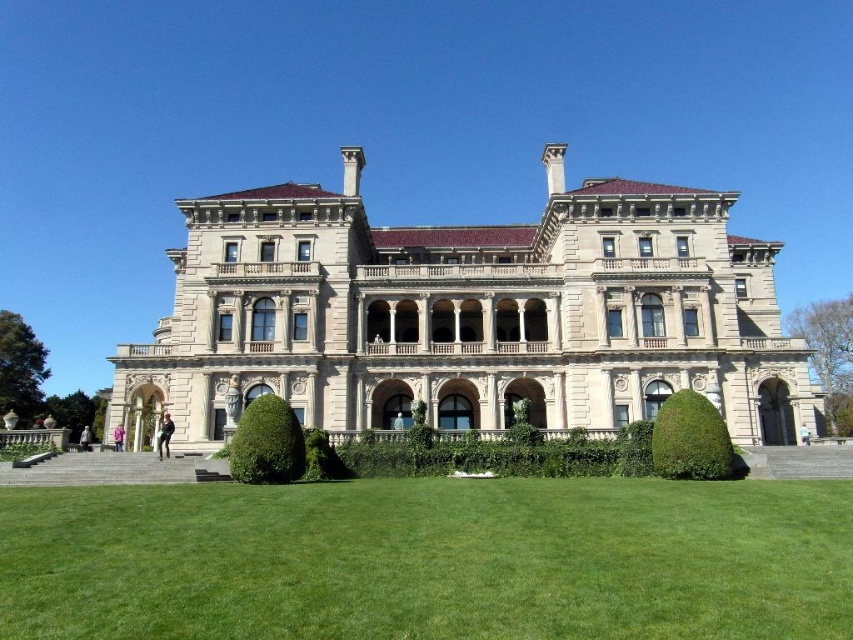
Question: Which object appears farthest from the camera in this image?

Choices:
 (A) green leafy hedge at lower right
 (B) green leafy hedge at center
 (C) green grass at lower center
 (D) beige stone mansion at center

Answer: (D)

Question: Is beige stone mansion at center closer to camera compared to green grass at lower center?

Choices:
 (A) no
 (B) yes

Answer: (A)

Question: In this image, where is beige stone mansion at center located relative to green leafy hedge at lower right?

Choices:
 (A) above
 (B) below

Answer: (A)

Question: Among these points, which one is nearest to the camera?

Choices:
 (A) (262, 426)
 (B) (347, 518)
 (C) (337, 428)
 (D) (683, 465)

Answer: (B)

Question: Estimate the real-world distances between objects in this image. Which object is closer to the green grass at lower center?

Choices:
 (A) green leafy hedge at center
 (B) beige stone mansion at center

Answer: (A)

Question: Is beige stone mansion at center to the left of green leafy hedge at center from the viewer's perspective?

Choices:
 (A) no
 (B) yes

Answer: (A)